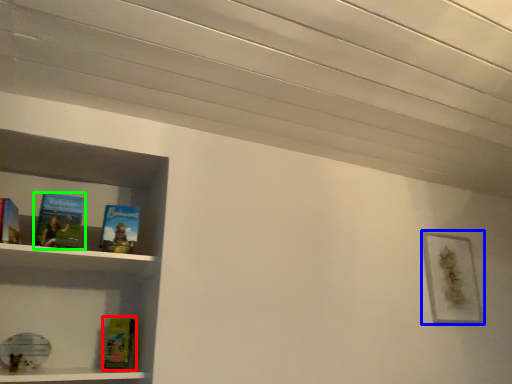
Question: Which object is positioned closest to paperback book (highlighted by a red box)? Select from picture frame (highlighted by a blue box) and book (highlighted by a green box).

Choices:
 (A) picture frame
 (B) book

Answer: (B)